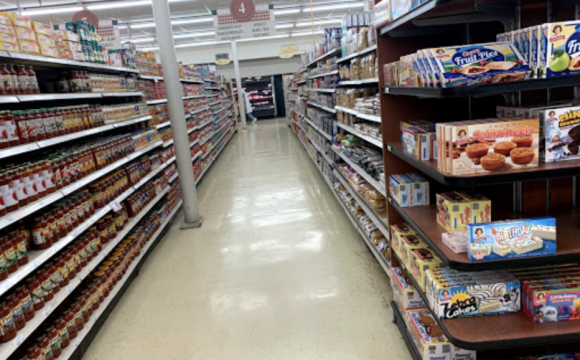
Find the location of a particular element. This screenshot has height=360, width=580. glare from lights is located at coordinates pos(279,217), pos(271,198), pos(309,241), pos(257,301).